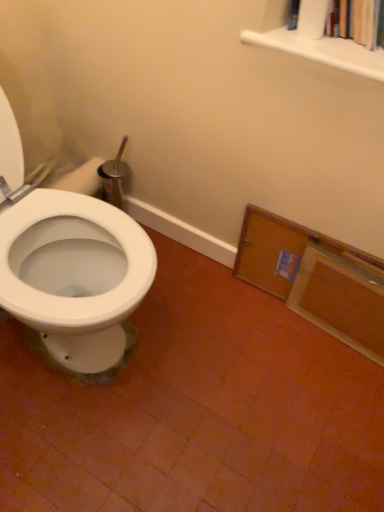
Describe the element at coordinates (315, 278) in the screenshot. I see `wooden cabinet at lower right` at that location.

What is the approximate height of wooden cabinet at lower right?

wooden cabinet at lower right is 13.13 inches tall.

At what (x,y) coordinates should I click in order to perform the action: click on wooden cabinet at lower right. Please return your answer as a coordinate pair (x, y). Looking at the image, I should click on (315, 278).

Identify the location of white matte bookshelf at upper right. [322, 51].

The image size is (384, 512). What do you see at coordinates (322, 51) in the screenshot?
I see `white matte bookshelf at upper right` at bounding box center [322, 51].

Locate an element on the screen. wooden cabinet at lower right is located at coordinates (315, 278).

Which is more to the right, white matte bookshelf at upper right or wooden cabinet at lower right?

white matte bookshelf at upper right.

Considering the positions of objects white matte bookshelf at upper right and wooden cabinet at lower right in the image provided, who is in front, white matte bookshelf at upper right or wooden cabinet at lower right?

white matte bookshelf at upper right.

Considering the points (271, 37) and (279, 257), which point is in front, point (271, 37) or point (279, 257)?

The point (271, 37) is closer to the camera.

From the image's perspective, which one is positioned higher, white matte bookshelf at upper right or wooden cabinet at lower right?

white matte bookshelf at upper right, from the image's perspective.

From a real-world perspective, which is physically above, white matte bookshelf at upper right or wooden cabinet at lower right?

white matte bookshelf at upper right.

Consider the image. Does white matte bookshelf at upper right have a greater width compared to wooden cabinet at lower right?

Yes, white matte bookshelf at upper right is wider than wooden cabinet at lower right.

Is white matte bookshelf at upper right taller or shorter than wooden cabinet at lower right?

Clearly, white matte bookshelf at upper right is shorter compared to wooden cabinet at lower right.

Does white matte bookshelf at upper right have a larger size compared to wooden cabinet at lower right?

No, white matte bookshelf at upper right is not bigger than wooden cabinet at lower right.

Can we say white matte bookshelf at upper right lies outside wooden cabinet at lower right?

That's correct, white matte bookshelf at upper right is outside of wooden cabinet at lower right.

Is there a large distance between white matte bookshelf at upper right and wooden cabinet at lower right?

Actually, white matte bookshelf at upper right and wooden cabinet at lower right are a little close together.

Could you tell me if white matte bookshelf at upper right is turned towards wooden cabinet at lower right?

No, white matte bookshelf at upper right is not aimed at wooden cabinet at lower right.

You are a GUI agent. You are given a task and a screenshot of the screen. Output one action in this format:
    pyautogui.click(x=<x>, y=<y>)
    Task: Click on the medicine cabinet below the white matte bookshelf at upper right (from a real-world perspective)
    This screenshot has width=384, height=512.
    Given the screenshot: What is the action you would take?
    pyautogui.click(x=315, y=278)

Which object is positioned more to the right, wooden cabinet at lower right or white matte bookshelf at upper right?

white matte bookshelf at upper right.

Which object is closer to the camera, wooden cabinet at lower right or white matte bookshelf at upper right?

white matte bookshelf at upper right is more forward.

Is point (264, 253) positioned after point (357, 63)?

Yes.

From the image's perspective, is wooden cabinet at lower right located above or below white matte bookshelf at upper right?

Based on their image positions, wooden cabinet at lower right is located beneath white matte bookshelf at upper right.

From a real-world perspective, is wooden cabinet at lower right positioned over white matte bookshelf at upper right based on gravity?

Incorrect, from a real-world perspective, wooden cabinet at lower right is lower than white matte bookshelf at upper right.

From the picture: Which of these two, wooden cabinet at lower right or white matte bookshelf at upper right, is wider?

With larger width is white matte bookshelf at upper right.

Can you confirm if wooden cabinet at lower right is taller than white matte bookshelf at upper right?

Yes.

Can you confirm if wooden cabinet at lower right is smaller than white matte bookshelf at upper right?

No.

Is white matte bookshelf at upper right located within wooden cabinet at lower right?

Actually, white matte bookshelf at upper right is outside wooden cabinet at lower right.

Is wooden cabinet at lower right in contact with white matte bookshelf at upper right?

wooden cabinet at lower right and white matte bookshelf at upper right are not in contact.

Is wooden cabinet at lower right oriented away from white matte bookshelf at upper right?

No, white matte bookshelf at upper right is not at the back of wooden cabinet at lower right.

What's the angular difference between wooden cabinet at lower right and white matte bookshelf at upper right's facing directions?

The facing directions of wooden cabinet at lower right and white matte bookshelf at upper right are 0.245 degrees apart.

Where is `bookcase above the wooden cabinet at lower right (from the image's perspective)`? This screenshot has height=512, width=384. bookcase above the wooden cabinet at lower right (from the image's perspective) is located at coordinates (322, 51).

Locate an element on the screen. Image resolution: width=384 pixels, height=512 pixels. medicine cabinet below the white matte bookshelf at upper right (from the image's perspective) is located at coordinates (315, 278).

Locate an element on the screen. This screenshot has width=384, height=512. medicine cabinet located on the left of white matte bookshelf at upper right is located at coordinates (315, 278).